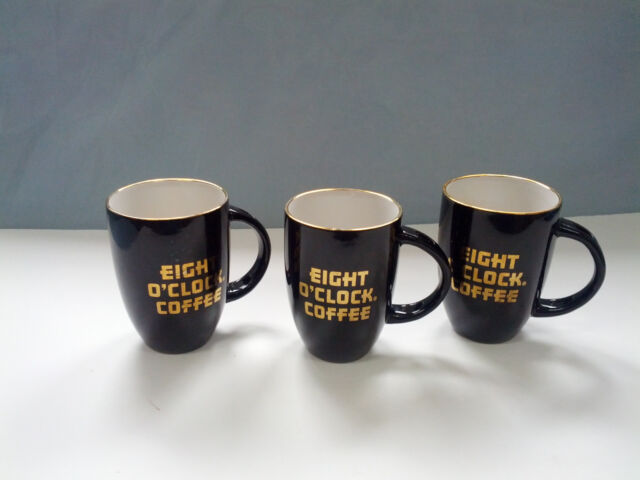
Where is `mug handle`? mug handle is located at coordinates (573, 233), (419, 236), (250, 219).